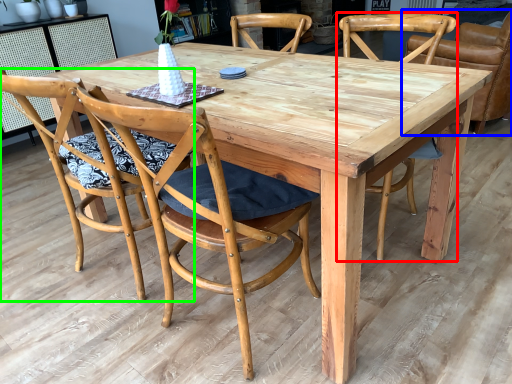
Question: Based on their relative distances, which object is nearer to chair (highlighted by a red box)? Choose from chair (highlighted by a blue box) and chair (highlighted by a green box).

Choices:
 (A) chair
 (B) chair

Answer: (A)